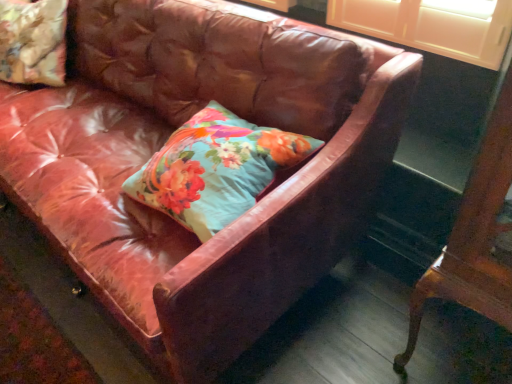
Describe the element at coordinates (476, 234) in the screenshot. This screenshot has width=512, height=384. I see `mahogany wood table at right` at that location.

This screenshot has width=512, height=384. What do you see at coordinates (33, 41) in the screenshot?
I see `floral fabric cushion at upper left, which appears as the second pillow when viewed from the front` at bounding box center [33, 41].

Identify the location of mahogany wood table at right. The image size is (512, 384). (476, 234).

Between mahogany wood table at right and floral fabric pillow at center, the second pillow viewed from the left, which one is positioned behind?

Positioned behind is floral fabric pillow at center, the second pillow viewed from the left.

How different are the orientations of mahogany wood table at right and floral fabric pillow at center, which appears as the first pillow when ordered from the bottom, in degrees?

There is a 0.406-degree angle between the facing directions of mahogany wood table at right and floral fabric pillow at center, which appears as the first pillow when ordered from the bottom.

Is mahogany wood table at right taller or shorter than floral fabric pillow at center, acting as the first pillow starting from the front?

mahogany wood table at right is taller than floral fabric pillow at center, acting as the first pillow starting from the front.

Based on their sizes in the image, would you say floral fabric cushion at upper left, which is counted as the 1th pillow, starting from the left, is bigger or smaller than mahogany wood table at right?

floral fabric cushion at upper left, which is counted as the 1th pillow, starting from the left, is smaller than mahogany wood table at right.

Looking at this image, between floral fabric cushion at upper left, which appears as the second pillow when viewed from the front, and mahogany wood table at right, which one has less height?

Standing shorter between the two is floral fabric cushion at upper left, which appears as the second pillow when viewed from the front.

Between floral fabric cushion at upper left, which appears as the first pillow when viewed from the top, and mahogany wood table at right, which one appears on the right side from the viewer's perspective?

From the viewer's perspective, mahogany wood table at right appears more on the right side.

Locate an element on the screen. furniture located on the right of floral fabric cushion at upper left, which appears as the first pillow when viewed from the top is located at coordinates (476, 234).

Considering the positions of objects floral fabric cushion at upper left, which appears as the second pillow when viewed from the front, and floral fabric pillow at center, the second pillow from the back, in the image provided, who is in front, floral fabric cushion at upper left, which appears as the second pillow when viewed from the front, or floral fabric pillow at center, the second pillow from the back,?

floral fabric pillow at center, the second pillow from the back, is more forward.

Does floral fabric cushion at upper left, which appears as the first pillow when viewed from the top, have a smaller size compared to floral fabric pillow at center, acting as the first pillow starting from the front?

Actually, floral fabric cushion at upper left, which appears as the first pillow when viewed from the top, might be larger than floral fabric pillow at center, acting as the first pillow starting from the front.

Which of these two, floral fabric cushion at upper left, which appears as the second pillow when viewed from the front, or floral fabric pillow at center, acting as the first pillow starting from the front, is thinner?

With smaller width is floral fabric cushion at upper left, which appears as the second pillow when viewed from the front.

Based on the photo, is floral fabric cushion at upper left, which appears as the second pillow when viewed from the front, positioned beyond the bounds of floral fabric pillow at center, the second pillow viewed from the left?

Indeed, floral fabric cushion at upper left, which appears as the second pillow when viewed from the front, is completely outside floral fabric pillow at center, the second pillow viewed from the left.

Can you confirm if floral fabric pillow at center, the second pillow from the back, is positioned to the right of floral fabric cushion at upper left, which ranks as the 2th pillow in right-to-left order?

Yes, floral fabric pillow at center, the second pillow from the back, is to the right of floral fabric cushion at upper left, which ranks as the 2th pillow in right-to-left order.

From a real-world perspective, is floral fabric pillow at center, the 2th pillow positioned from the top, below floral fabric cushion at upper left, which is counted as the 1th pillow, starting from the left?

Indeed, from a real-world perspective, floral fabric pillow at center, the 2th pillow positioned from the top, is positioned beneath floral fabric cushion at upper left, which is counted as the 1th pillow, starting from the left.

Is floral fabric pillow at center, acting as the first pillow starting from the front, far from floral fabric cushion at upper left, which ranks as the 2th pillow in right-to-left order?

Indeed, floral fabric pillow at center, acting as the first pillow starting from the front, is not near floral fabric cushion at upper left, which ranks as the 2th pillow in right-to-left order.

Consider the image. Is floral fabric pillow at center, the second pillow viewed from the left, spatially inside floral fabric cushion at upper left, which appears as the first pillow when viewed from the top, or outside of it?

floral fabric pillow at center, the second pillow viewed from the left, is not inside floral fabric cushion at upper left, which appears as the first pillow when viewed from the top, it's outside.

Is mahogany wood table at right oriented away from floral fabric cushion at upper left, which appears as the first pillow when viewed from the back?

mahogany wood table at right does not have its back to floral fabric cushion at upper left, which appears as the first pillow when viewed from the back.

From a real-world perspective, which is physically above, mahogany wood table at right or floral fabric cushion at upper left, which ranks as the 2th pillow in right-to-left order?

floral fabric cushion at upper left, which ranks as the 2th pillow in right-to-left order.

Is mahogany wood table at right taller or shorter than floral fabric cushion at upper left, which ranks as the 2th pillow in right-to-left order?

mahogany wood table at right is taller than floral fabric cushion at upper left, which ranks as the 2th pillow in right-to-left order.

Consider the image. Which is nearer, (240, 210) or (487, 146)?

Point (240, 210) is farther from the camera than point (487, 146).

Is floral fabric pillow at center, the second pillow viewed from the left, wider or thinner than mahogany wood table at right?

In the image, floral fabric pillow at center, the second pillow viewed from the left, appears to be wider than mahogany wood table at right.

From a real-world perspective, is floral fabric pillow at center, the 2th pillow positioned from the top, positioned above or below mahogany wood table at right?

Clearly, from a real-world perspective, floral fabric pillow at center, the 2th pillow positioned from the top, is above mahogany wood table at right.

The image size is (512, 384). I want to click on furniture in front of the floral fabric pillow at center, acting as the first pillow starting from the front, so click(x=476, y=234).

I want to click on furniture below the floral fabric cushion at upper left, which is counted as the 1th pillow, starting from the left (from a real-world perspective), so click(476, 234).

Estimate the real-world distances between objects in this image. Which object is further from floral fabric cushion at upper left, which appears as the second pillow when viewed from the front, mahogany wood table at right or floral fabric pillow at center, the second pillow viewed from the left?

Among the two, mahogany wood table at right is located further to floral fabric cushion at upper left, which appears as the second pillow when viewed from the front.

Considering their positions, is floral fabric pillow at center, the 2th pillow positioned from the top, positioned further to mahogany wood table at right than floral fabric cushion at upper left, which is the 2th pillow from bottom to top?

The object further to mahogany wood table at right is floral fabric cushion at upper left, which is the 2th pillow from bottom to top.

Considering their positions, is floral fabric cushion at upper left, which appears as the first pillow when viewed from the back, positioned closer to floral fabric pillow at center, acting as the first pillow starting from the front, than mahogany wood table at right?

The object closer to floral fabric pillow at center, acting as the first pillow starting from the front, is mahogany wood table at right.

Estimate the real-world distances between objects in this image. Which object is further from mahogany wood table at right, floral fabric cushion at upper left, which appears as the first pillow when viewed from the top, or floral fabric pillow at center, the 2th pillow positioned from the top?

floral fabric cushion at upper left, which appears as the first pillow when viewed from the top, is further to mahogany wood table at right.

Estimate the real-world distances between objects in this image. Which object is further from floral fabric pillow at center, acting as the first pillow starting from the front, mahogany wood table at right or floral fabric cushion at upper left, which is the 2th pillow from bottom to top?

floral fabric cushion at upper left, which is the 2th pillow from bottom to top.

Consider the image. From the image, which object appears to be farther from floral fabric cushion at upper left, which is the 2th pillow from bottom to top, floral fabric pillow at center, the second pillow from the back, or mahogany wood table at right?

mahogany wood table at right is further to floral fabric cushion at upper left, which is the 2th pillow from bottom to top.

You are a GUI agent. You are given a task and a screenshot of the screen. Output one action in this format:
    pyautogui.click(x=<x>, y=<y>)
    Task: Click on the pillow between floral fabric cushion at upper left, which appears as the first pillow when viewed from the top, and mahogany wood table at right from left to right
    This screenshot has width=512, height=384.
    Given the screenshot: What is the action you would take?
    pyautogui.click(x=215, y=169)